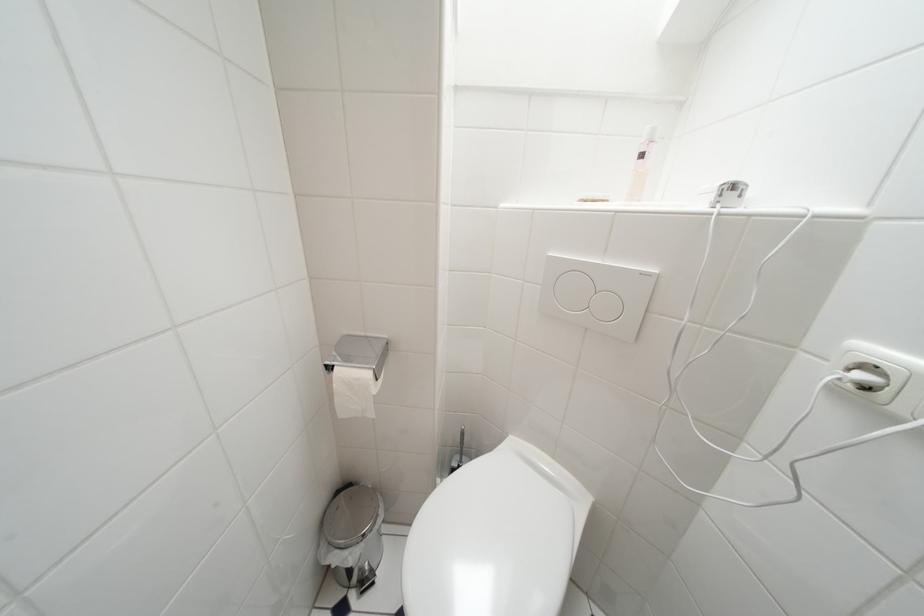
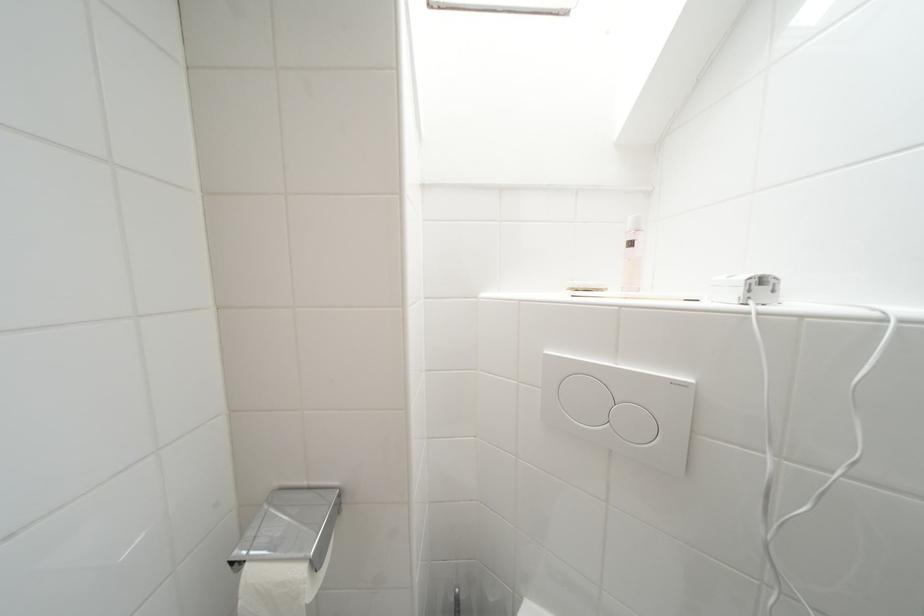
In the second image, find the point that corresponds to the point at 375,378 in the first image.

(309, 575)